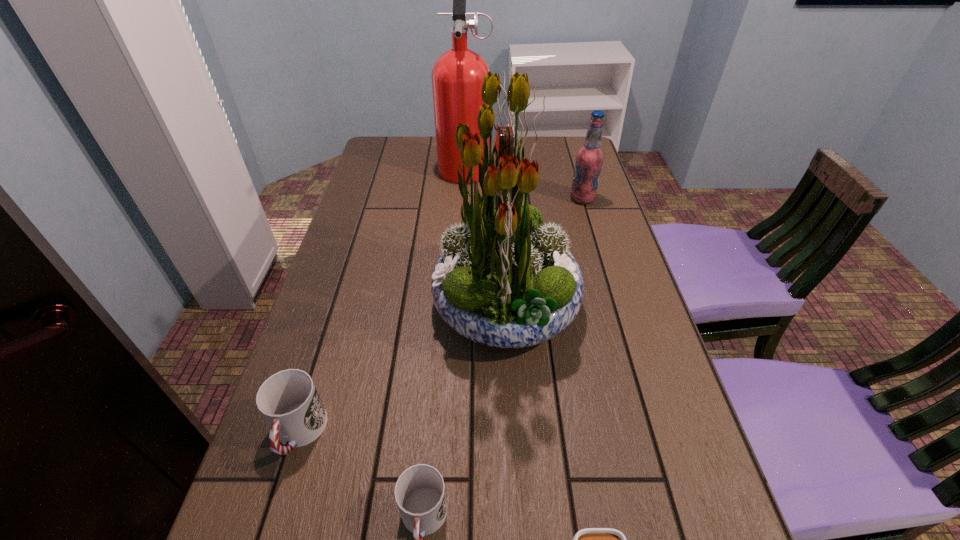
Locate an element on the screen. vacant space located 0.160m on the left of the alcohol is located at coordinates (518, 199).

This screenshot has height=540, width=960. I want to click on vacant space located on the side of the fourth farthest object where the handle is located, so click(278, 500).

Where is `object that is at the far edge`? The image size is (960, 540). object that is at the far edge is located at coordinates (457, 76).

You are a GUI agent. You are given a task and a screenshot of the screen. Output one action in this format:
    pyautogui.click(x=<x>, y=<y>)
    Task: Click on the object positioned at the left edge
    This screenshot has height=540, width=960.
    Given the screenshot: What is the action you would take?
    pyautogui.click(x=288, y=400)

Locate an element on the screen. This screenshot has width=960, height=540. flower arrangement that is at the right edge is located at coordinates (503, 280).

I want to click on alcohol situated at the right edge, so click(x=589, y=159).

Where is `vacant space at the far edge of the desktop`? The image size is (960, 540). vacant space at the far edge of the desktop is located at coordinates (426, 152).

The height and width of the screenshot is (540, 960). What are the coordinates of `vacant region at the left edge` in the screenshot? It's located at point(363,316).

In the image, there is a desktop. Where is `free space at the right edge`? The height and width of the screenshot is (540, 960). free space at the right edge is located at coordinates (687, 494).

Locate an element on the screen. blank space at the far right corner of the desktop is located at coordinates (572, 142).